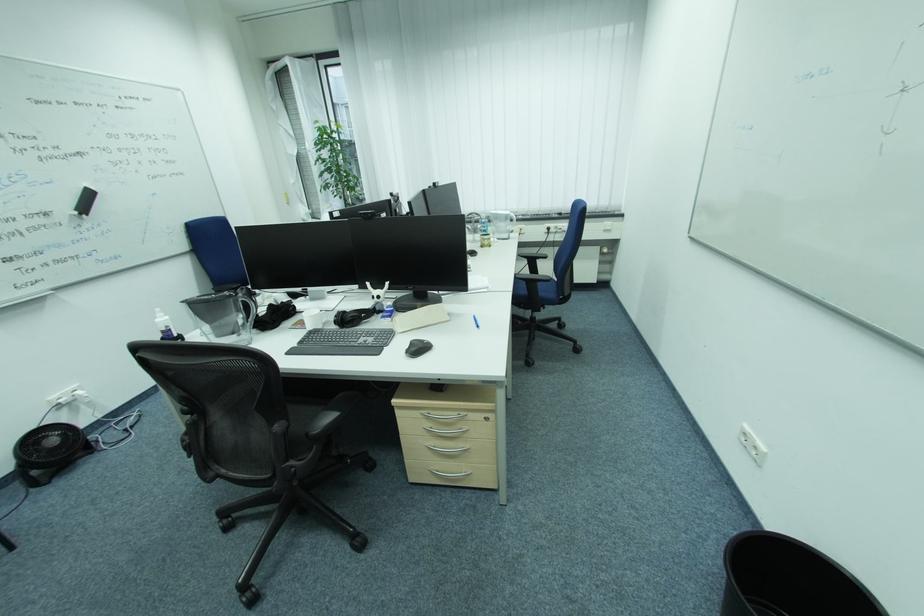
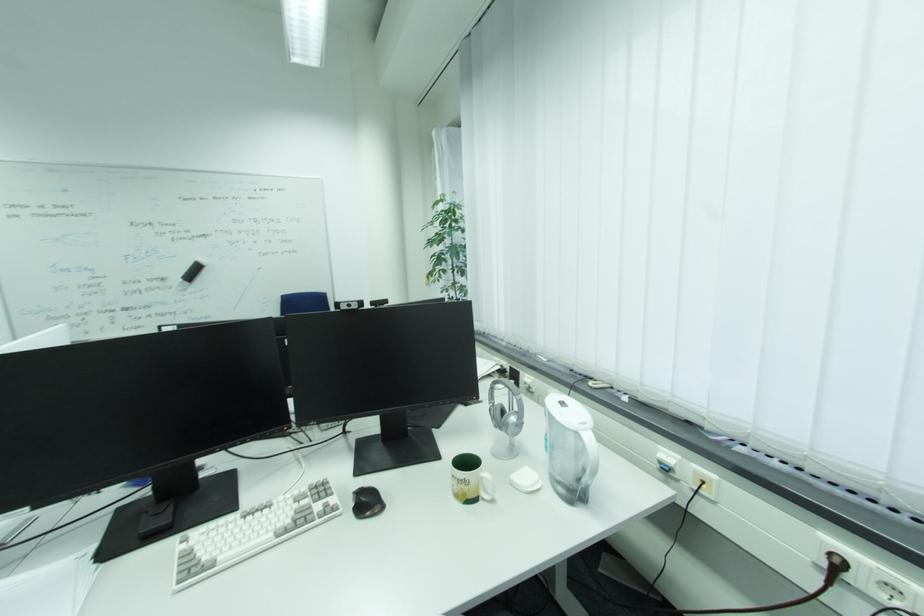
The point at (81,211) is marked in the first image. Where is the corresponding point in the second image?

(189, 278)